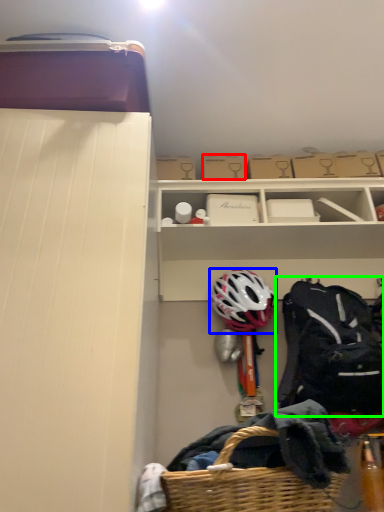
Question: Which object is positioned closest to storage box (highlighted by a red box)? Select from helmet (highlighted by a blue box) and backpack (highlighted by a green box).

Choices:
 (A) helmet
 (B) backpack

Answer: (A)